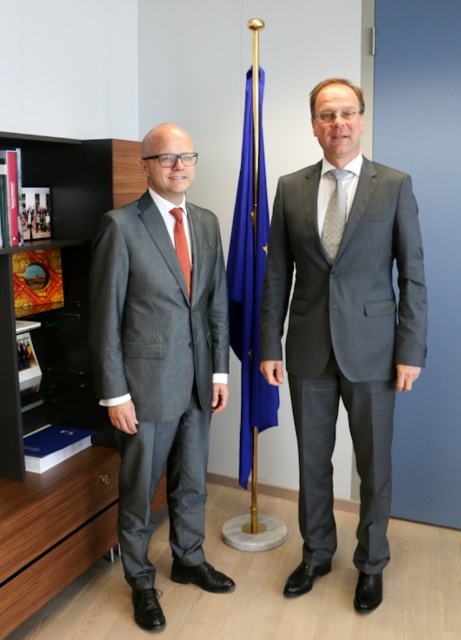
Does matte gray suit at left have a greater height compared to gray textured tie at center?

Correct, matte gray suit at left is much taller as gray textured tie at center.

Where is `matte gray suit at left`? matte gray suit at left is located at coordinates (160, 364).

What do you see at coordinates (160, 364) in the screenshot?
I see `matte gray suit at left` at bounding box center [160, 364].

This screenshot has height=640, width=461. Find the location of `matte gray suit at left`. matte gray suit at left is located at coordinates (160, 364).

Does blue fabric flag at center appear over orange silk tie at left?

No, blue fabric flag at center is not above orange silk tie at left.

Is blue fabric flag at center bigger than orange silk tie at left?

Yes, blue fabric flag at center is bigger than orange silk tie at left.

Is point (242, 352) farther from camera compared to point (187, 276)?

That is True.

Where is `blue fabric flag at center`? The height and width of the screenshot is (640, 461). blue fabric flag at center is located at coordinates (249, 275).

Who is positioned more to the left, matte gray suit at right or blue fabric flag at center?

Positioned to the left is blue fabric flag at center.

Can you confirm if matte gray suit at right is positioned above blue fabric flag at center?

No.

Find the location of a particular element. matte gray suit at right is located at coordinates (343, 332).

Where is `matte gray suit at right`? matte gray suit at right is located at coordinates (343, 332).